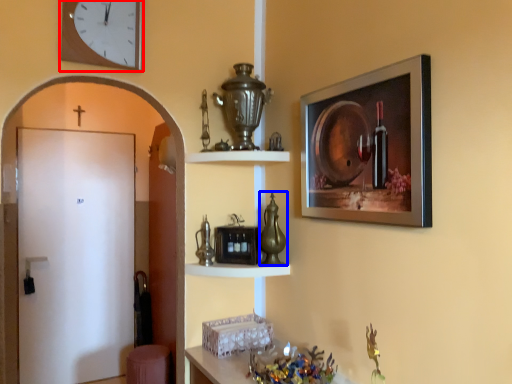
Question: Which object appears farthest to the camera in this image, clock (highlighted by a red box) or glass vase (highlighted by a blue box)?

Choices:
 (A) clock
 (B) glass vase

Answer: (B)